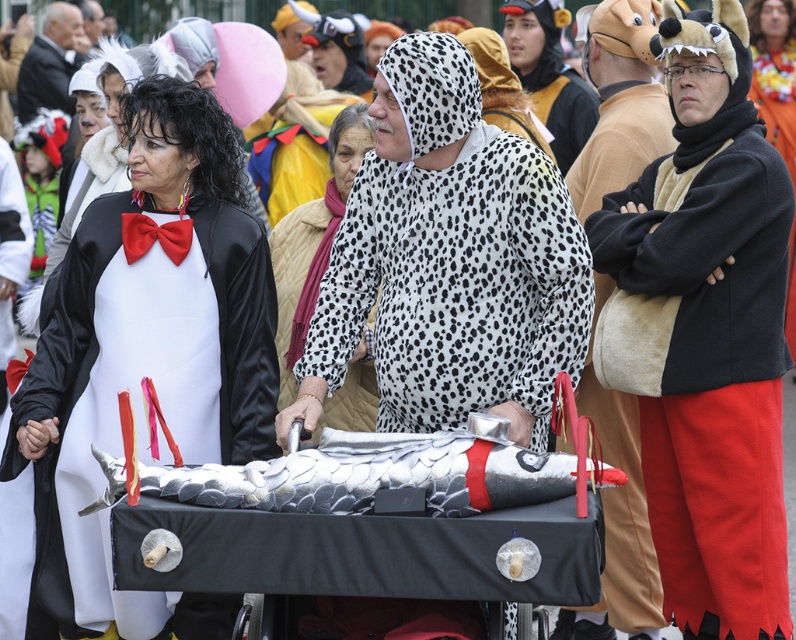
Which is in front, point (268, 372) or point (467, 236)?

Point (467, 236) is more forward.

Is white matte penguin costume at left closer to the viewer compared to spotted fabric costume at center?

No, white matte penguin costume at left is further to the viewer.

Find the location of a particular element. white matte penguin costume at left is located at coordinates (147, 355).

At what (x,y) coordinates should I click in order to perform the action: click on white matte penguin costume at left. Please return your answer as a coordinate pair (x, y). Looking at the image, I should click on (147, 355).

Is point (225, 612) closer to camera compared to point (341, 184)?

Yes, point (225, 612) is in front of point (341, 184).

Based on the photo, who is shorter, white matte penguin costume at left or white quilted vest at center?

white quilted vest at center is shorter.

Measure the distance between white matte penguin costume at left and camera.

The distance of white matte penguin costume at left from camera is 18.54 meters.

You are a GUI agent. You are given a task and a screenshot of the screen. Output one action in this format:
    pyautogui.click(x=<x>, y=<y>)
    Task: Click on the white matte penguin costume at left
    
    Given the screenshot: What is the action you would take?
    pyautogui.click(x=147, y=355)

Describe the element at coordinates (449, 260) in the screenshot. The width and height of the screenshot is (796, 640). I see `spotted fabric costume at center` at that location.

Is point (381, 212) positioned after point (666, 125)?

No, it is not.

This screenshot has height=640, width=796. What do you see at coordinates (449, 260) in the screenshot? I see `spotted fabric costume at center` at bounding box center [449, 260].

You are a GUI agent. You are given a task and a screenshot of the screen. Output one action in this format:
    pyautogui.click(x=<x>, y=<y>)
    Task: Click on the spotted fabric costume at center
    This screenshot has height=640, width=796.
    Given the screenshot: What is the action you would take?
    pyautogui.click(x=449, y=260)